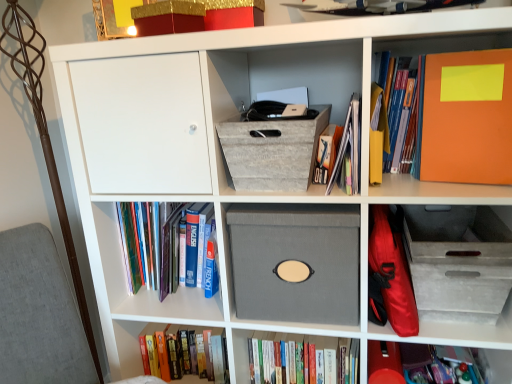
This screenshot has height=384, width=512. In order to click on matte gray shoe box at lower right, which is the 3th shoe box in left-to-right order in this screenshot , I will do `click(458, 261)`.

In order to face textured gray shoe box at center, the 3th shoe box viewed from the right, should I rotate leftwards or rightwards?

You should rotate right by 3.118 degrees.

What is the approximate width of textured gray shoe box at center, the 1th shoe box positioned from the left?

It is 30.66 centimeters.

You are a GUI agent. You are given a task and a screenshot of the screen. Output one action in this format:
    pyautogui.click(x=<x>, y=<y>)
    Task: Click on the matte orange folder at upper right, the 2th book in the top-to-bottom sequence
    Image resolution: width=512 pixels, height=384 pixels.
    Given the screenshot: What is the action you would take?
    pyautogui.click(x=347, y=146)

What is the approximate height of matte orange folder at upper right, the 2th book in the top-to-bottom sequence?

matte orange folder at upper right, the 2th book in the top-to-bottom sequence, is 8.25 inches tall.

What is the approximate height of yellow paper at upper right, which is the 1th paperback book from left to right?

yellow paper at upper right, which is the 1th paperback book from left to right, is 8.96 inches tall.

Where is `hardcover book at upper right, the first book viewed from the top`? hardcover book at upper right, the first book viewed from the top is located at coordinates (399, 110).

Is hardcover book at upper right, which is counted as the 6th book, starting from the bottom, outside of matte gray shoe box at lower right, positioned as the first shoe box in right-to-left order?

That's correct, hardcover book at upper right, which is counted as the 6th book, starting from the bottom, is outside of matte gray shoe box at lower right, positioned as the first shoe box in right-to-left order.

Is hardcover book at upper right, the first book viewed from the top, placed right next to matte gray shoe box at lower right, positioned as the first shoe box in right-to-left order?

hardcover book at upper right, the first book viewed from the top, and matte gray shoe box at lower right, positioned as the first shoe box in right-to-left order, are not in contact.

Considering the sizes of objects hardcover book at upper right, the first book viewed from the top, and matte gray shoe box at lower right, positioned as the first shoe box in right-to-left order, in the image provided, who is taller, hardcover book at upper right, the first book viewed from the top, or matte gray shoe box at lower right, positioned as the first shoe box in right-to-left order,?

Standing taller between the two is hardcover book at upper right, the first book viewed from the top.

Is yellow paper at upper right, marked as the 2th paperback book in a right-to-left arrangement, not close to matte red book at lower right, the 2th book when ordered from bottom to top?

No, yellow paper at upper right, marked as the 2th paperback book in a right-to-left arrangement, is in close proximity to matte red book at lower right, the 2th book when ordered from bottom to top.

From a real-world perspective, relative to matte red book at lower right, which ranks as the fifth book in top-to-bottom order, is yellow paper at upper right, which is the 1th paperback book from left to right, vertically above or below?

Clearly, from a real-world perspective, yellow paper at upper right, which is the 1th paperback book from left to right, is above matte red book at lower right, which ranks as the fifth book in top-to-bottom order.

Which of these two, yellow paper at upper right, which is the 1th paperback book from left to right, or matte red book at lower right, the 2th book when ordered from bottom to top, stands taller?

yellow paper at upper right, which is the 1th paperback book from left to right.

In terms of width, does yellow paper at upper right, which is the 1th paperback book from left to right, look wider or thinner when compared to matte red book at lower right, the 2th book when ordered from bottom to top?

yellow paper at upper right, which is the 1th paperback book from left to right, is thinner than matte red book at lower right, the 2th book when ordered from bottom to top.

Is point (397, 141) closer or farther from the camera than point (199, 210)?

Point (397, 141).

Considering the positions of objects hardcover book at upper right, the first book viewed from the top, and hardcover books at left, the 3th book in the top-to-bottom sequence, in the image provided, who is more to the left, hardcover book at upper right, the first book viewed from the top, or hardcover books at left, the 3th book in the top-to-bottom sequence,?

Positioned to the left is hardcover books at left, the 3th book in the top-to-bottom sequence.

Considering the relative sizes of hardcover book at upper right, the first book viewed from the top, and hardcover books at left, the 3th book in the top-to-bottom sequence, in the image provided, is hardcover book at upper right, the first book viewed from the top, taller than hardcover books at left, the 3th book in the top-to-bottom sequence,?

Yes, hardcover book at upper right, the first book viewed from the top, is taller than hardcover books at left, the 3th book in the top-to-bottom sequence.

Is hardcover book at upper right, which is counted as the 6th book, starting from the bottom, oriented towards hardcover books at left, the fourth book positioned from the bottom?

No, hardcover book at upper right, which is counted as the 6th book, starting from the bottom, does not turn towards hardcover books at left, the fourth book positioned from the bottom.

Is hardcover books at left, the 3th book in the top-to-bottom sequence, shorter than hardcover book at upper right, the first book viewed from the top?

Indeed, hardcover books at left, the 3th book in the top-to-bottom sequence, has a lesser height compared to hardcover book at upper right, the first book viewed from the top.

From a real-world perspective, is hardcover books at left, the 3th book in the top-to-bottom sequence, under hardcover book at upper right, which is counted as the 6th book, starting from the bottom?

Yes, from a real-world perspective, hardcover books at left, the 3th book in the top-to-bottom sequence, is below hardcover book at upper right, which is counted as the 6th book, starting from the bottom.

Based on the photo, could you tell me if hardcover books at left, the fourth book positioned from the bottom, is facing hardcover book at upper right, the first book viewed from the top?

No, hardcover books at left, the fourth book positioned from the bottom, does not turn towards hardcover book at upper right, the first book viewed from the top.

Is point (357, 168) positioned in front of point (400, 150)?

Yes, point (357, 168) is in front of point (400, 150).

From the image's perspective, which is above, matte orange folder at upper right, the 2th book in the top-to-bottom sequence, or hardcover book at upper right, which is counted as the 6th book, starting from the bottom?

hardcover book at upper right, which is counted as the 6th book, starting from the bottom, appears higher in the image.

Which of these two, matte orange folder at upper right, the fifth book positioned from the bottom, or hardcover book at upper right, the first book viewed from the top, is bigger?

matte orange folder at upper right, the fifth book positioned from the bottom.

Can you confirm if matte orange folder at upper right, the fifth book positioned from the bottom, is wider than hardcover book at upper right, which is counted as the 6th book, starting from the bottom?

Yes.

Does gray fabric shoe box at center, the second shoe box in the right-to-left sequence, appear on the left side of hardcover book at lower center, which is the sixth book in top-to-bottom order?

Yes.

Can we say gray fabric shoe box at center, marked as the second shoe box in a left-to-right arrangement, lies outside hardcover book at lower center, which is the sixth book in top-to-bottom order?

That's correct, gray fabric shoe box at center, marked as the second shoe box in a left-to-right arrangement, is outside of hardcover book at lower center, which is the sixth book in top-to-bottom order.

Considering the sizes of gray fabric shoe box at center, marked as the second shoe box in a left-to-right arrangement, and hardcover book at lower center, acting as the 1th book starting from the bottom, in the image, is gray fabric shoe box at center, marked as the second shoe box in a left-to-right arrangement, bigger or smaller than hardcover book at lower center, acting as the 1th book starting from the bottom,?

Clearly, gray fabric shoe box at center, marked as the second shoe box in a left-to-right arrangement, is larger in size than hardcover book at lower center, acting as the 1th book starting from the bottom.

Is the surface of gray fabric shoe box at center, marked as the second shoe box in a left-to-right arrangement, in direct contact with hardcover book at lower center, acting as the 1th book starting from the bottom?

gray fabric shoe box at center, marked as the second shoe box in a left-to-right arrangement, and hardcover book at lower center, acting as the 1th book starting from the bottom, are not in contact.

Considering the sizes of objects orange matte folder at upper right, acting as the 2th paperback book starting from the left, and textured gray shoe box at center, the 3th shoe box viewed from the right, in the image provided, who is taller, orange matte folder at upper right, acting as the 2th paperback book starting from the left, or textured gray shoe box at center, the 3th shoe box viewed from the right,?

orange matte folder at upper right, acting as the 2th paperback book starting from the left.

Can you confirm if orange matte folder at upper right, the 1th paperback book when ordered from right to left, is thinner than textured gray shoe box at center, the 1th shoe box positioned from the left?

Indeed, orange matte folder at upper right, the 1th paperback book when ordered from right to left, has a lesser width compared to textured gray shoe box at center, the 1th shoe box positioned from the left.

How much distance is there between orange matte folder at upper right, acting as the 2th paperback book starting from the left, and textured gray shoe box at center, the 1th shoe box positioned from the left?

orange matte folder at upper right, acting as the 2th paperback book starting from the left, and textured gray shoe box at center, the 1th shoe box positioned from the left, are 13.93 inches apart from each other.

From the image's perspective, which one is positioned higher, orange matte folder at upper right, the 1th paperback book when ordered from right to left, or textured gray shoe box at center, the 1th shoe box positioned from the left?

orange matte folder at upper right, the 1th paperback book when ordered from right to left.

Locate an element on the screen. the 3rd shoe box located beneath the hardcover book at upper right, the first book viewed from the top (from a real-world perspective) is located at coordinates (458, 261).

Where is `the 3rd book below when counting from the yellow paper at upper right, marked as the 2th paperback book in a right-to-left arrangement (from the image's perspective)`? The width and height of the screenshot is (512, 384). the 3rd book below when counting from the yellow paper at upper right, marked as the 2th paperback book in a right-to-left arrangement (from the image's perspective) is located at coordinates (396, 361).

Looking at this image, which object lies further to the anchor point textured gray shoe box at center, the 1th shoe box positioned from the left, matte gray shoe box at lower right, positioned as the first shoe box in right-to-left order, or hardcover book at upper right, the first book viewed from the top?

matte gray shoe box at lower right, positioned as the first shoe box in right-to-left order.

Based on their spatial positions, is hardcover book at lower center, which is the sixth book in top-to-bottom order, or matte orange folder at upper right, the fifth book positioned from the bottom, closer to hardcover book at lower center, arranged as the fourth book when viewed from the top?

hardcover book at lower center, which is the sixth book in top-to-bottom order, is positioned closer to the anchor hardcover book at lower center, arranged as the fourth book when viewed from the top.

Estimate the real-world distances between objects in this image. Which object is closer to hardcover book at lower center, which is the sixth book in top-to-bottom order, orange matte folder at upper right, acting as the 2th paperback book starting from the left, or hardcover books at left, the 3th book in the top-to-bottom sequence?

Based on the image, hardcover books at left, the 3th book in the top-to-bottom sequence, appears to be nearer to hardcover book at lower center, which is the sixth book in top-to-bottom order.

When comparing their distances from gray fabric shoe box at center, the second shoe box in the right-to-left sequence, does hardcover book at lower center, arranged as the fourth book when viewed from the top, or yellow paper at upper right, marked as the 2th paperback book in a right-to-left arrangement, seem further?

Among the two, hardcover book at lower center, arranged as the fourth book when viewed from the top, is located further to gray fabric shoe box at center, the second shoe box in the right-to-left sequence.

From the image, which object appears to be farther from hardcover book at lower center, acting as the 1th book starting from the bottom, matte gray shoe box at lower right, which is the 3th shoe box in left-to-right order, or hardcover books at left, the fourth book positioned from the bottom?

hardcover books at left, the fourth book positioned from the bottom, lies further to hardcover book at lower center, acting as the 1th book starting from the bottom, than the other object.

Considering their positions, is textured gray shoe box at center, the 3th shoe box viewed from the right, positioned further to yellow paper at upper right, marked as the 2th paperback book in a right-to-left arrangement, than matte orange folder at upper right, the fifth book positioned from the bottom?

textured gray shoe box at center, the 3th shoe box viewed from the right, lies further to yellow paper at upper right, marked as the 2th paperback book in a right-to-left arrangement, than the other object.

Looking at the image, which one is located closer to textured gray shoe box at center, the 1th shoe box positioned from the left, matte gray shoe box at lower right, which is the 3th shoe box in left-to-right order, or hardcover books at left, the 3th book in the top-to-bottom sequence?

hardcover books at left, the 3th book in the top-to-bottom sequence, is positioned closer to the anchor textured gray shoe box at center, the 1th shoe box positioned from the left.

Looking at the image, which one is located closer to matte orange folder at upper right, the fifth book positioned from the bottom, hardcover book at upper right, the first book viewed from the top, or hardcover book at lower center, which is the sixth book in top-to-bottom order?

hardcover book at upper right, the first book viewed from the top, lies closer to matte orange folder at upper right, the fifth book positioned from the bottom, than the other object.

You are a GUI agent. You are given a task and a screenshot of the screen. Output one action in this format:
    pyautogui.click(x=<x>, y=<y>)
    Task: Click on the shoe box located between textured gray shoe box at center, the 3th shoe box viewed from the right, and matte gray shoe box at lower right, which is the 3th shoe box in left-to-right order, in the left-right direction
    This screenshot has height=384, width=512.
    Given the screenshot: What is the action you would take?
    coord(296,259)

This screenshot has width=512, height=384. What are the coordinates of `paperback book between gray fabric shoe box at center, the second shoe box in the right-to-left sequence, and orange matte folder at upper right, the 1th paperback book when ordered from right to left, from left to right` in the screenshot? It's located at (377, 134).

The height and width of the screenshot is (384, 512). Identify the location of shoe box between yellow paper at upper right, which is the 1th paperback book from left to right, and gray fabric shoe box at center, marked as the second shoe box in a left-to-right arrangement, vertically. (272, 149).

Where is `paperback book between orange matte folder at upper right, the 1th paperback book when ordered from right to left, and hardcover book at lower center, which ranks as the third book in bottom-to-top order, in the up-down direction`? paperback book between orange matte folder at upper right, the 1th paperback book when ordered from right to left, and hardcover book at lower center, which ranks as the third book in bottom-to-top order, in the up-down direction is located at coordinates (377, 134).